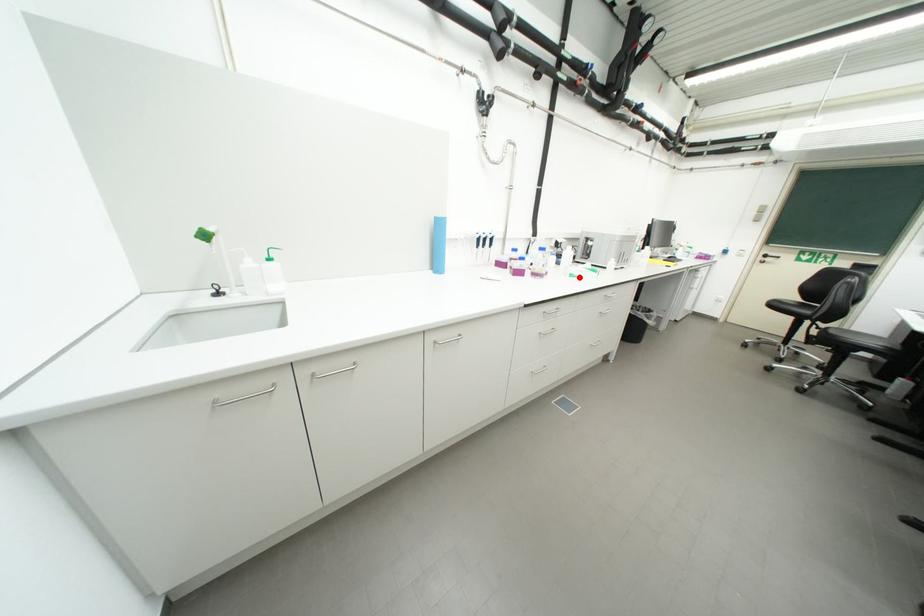
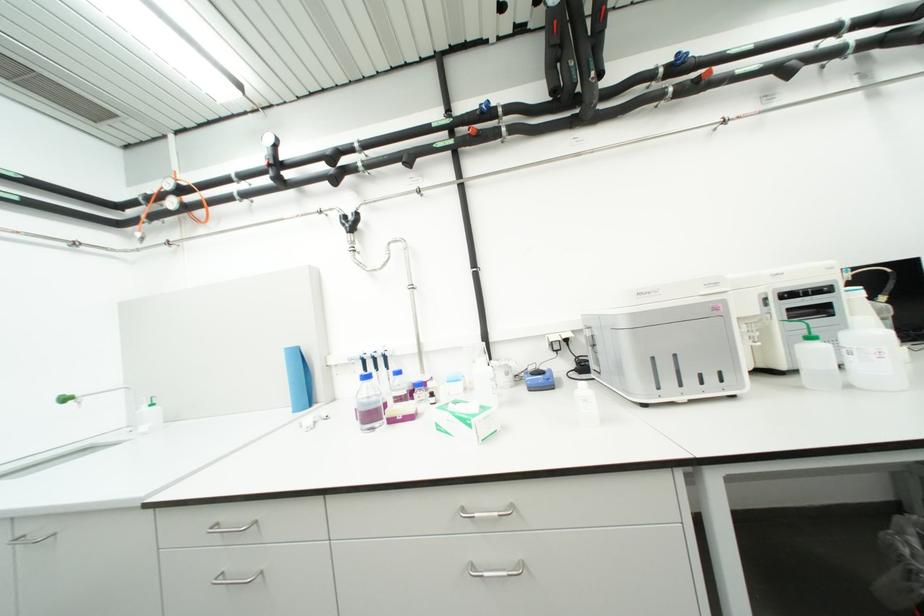
Where in the second image is the point corresponding to the highlighted location from the first image?

(446, 429)